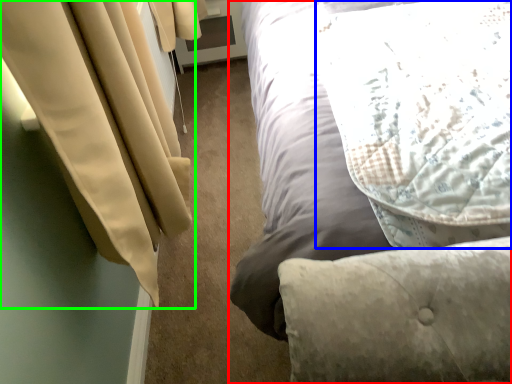
Question: Which is farther away from bed (highlighted by a red box)? pillow (highlighted by a blue box) or curtain (highlighted by a green box)?

Choices:
 (A) pillow
 (B) curtain

Answer: (B)